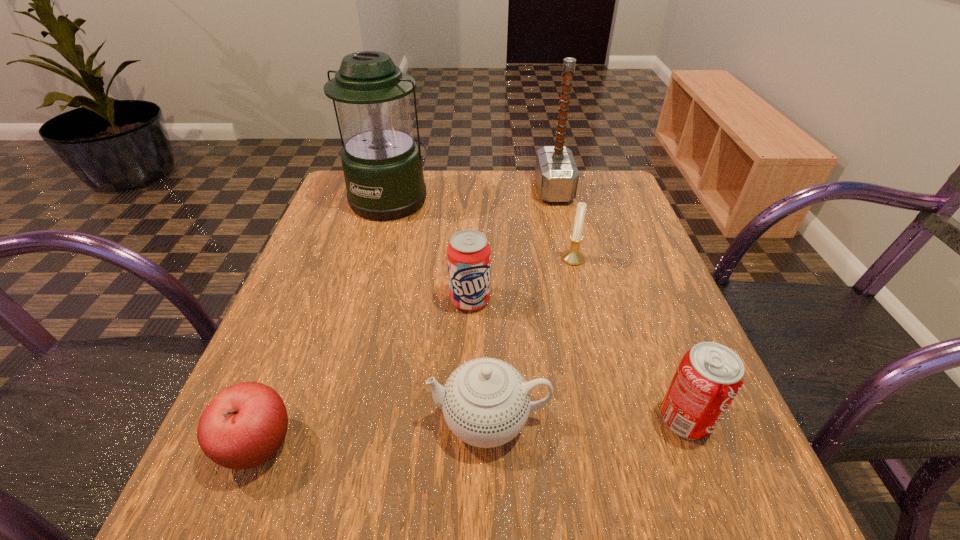
The image size is (960, 540). Find the location of `lantern at the far edge`. lantern at the far edge is located at coordinates (382, 165).

I want to click on hammer located at the far edge, so click(557, 176).

Locate an element on the screen. object located in the near edge section of the desktop is located at coordinates (244, 425).

Where is `lantern positioned at the left edge`? This screenshot has width=960, height=540. lantern positioned at the left edge is located at coordinates (382, 165).

You are a GUI agent. You are given a task and a screenshot of the screen. Output one action in this format:
    pyautogui.click(x=<x>, y=<y>)
    Task: Click on the apple located at the left edge
    
    Given the screenshot: What is the action you would take?
    pyautogui.click(x=244, y=425)

Image resolution: width=960 pixels, height=540 pixels. In order to click on hammer at the right edge in this screenshot , I will do `click(557, 176)`.

At what (x,y) coordinates should I click in order to perform the action: click on candle holder at the right edge. Please return your answer as a coordinate pair (x, y). The height and width of the screenshot is (540, 960). Looking at the image, I should click on (572, 256).

This screenshot has height=540, width=960. I want to click on soda can situated at the right edge, so click(x=710, y=375).

Image resolution: width=960 pixels, height=540 pixels. What are the coordinates of `object at the far left corner` in the screenshot? It's located at (382, 165).

Identify the location of object situated at the near left corner. (244, 425).